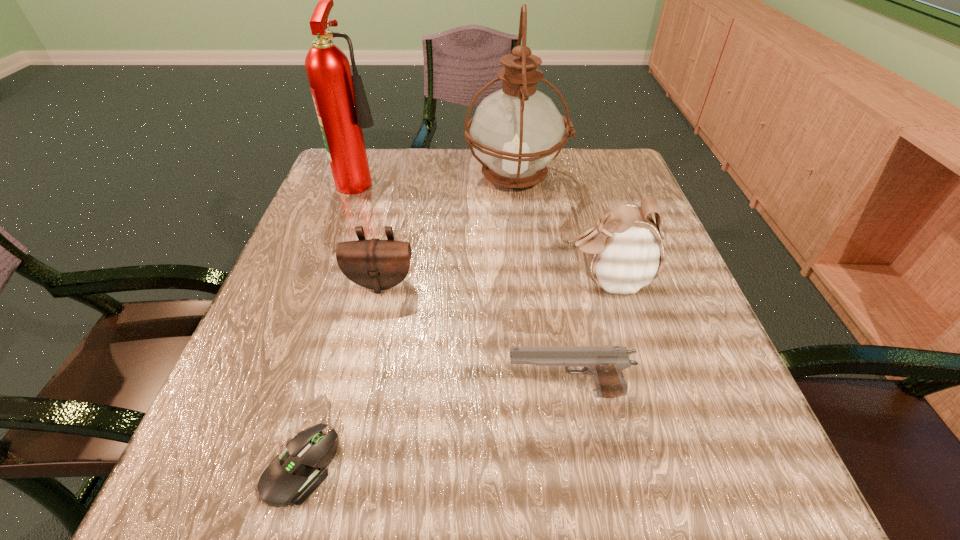
Locate an element on the screen. object present at the near edge is located at coordinates (292, 477).

Where is `fire extinguisher that is at the left edge`? fire extinguisher that is at the left edge is located at coordinates (340, 100).

The height and width of the screenshot is (540, 960). I want to click on pouch that is positioned at the left edge, so click(376, 264).

In order to click on computer mouse that is at the left edge in this screenshot , I will do 292,477.

Find the location of `oil lamp present at the right edge`. oil lamp present at the right edge is located at coordinates (517, 131).

The image size is (960, 540). I want to click on pouch that is at the right edge, so click(x=625, y=251).

Where is `pistol positioned at the right edge`? pistol positioned at the right edge is located at coordinates (605, 364).

Where is `object at the far left corner`? This screenshot has width=960, height=540. object at the far left corner is located at coordinates (340, 100).

The image size is (960, 540). I want to click on object that is at the near left corner, so click(292, 477).

The width and height of the screenshot is (960, 540). In order to click on object positioned at the far right corner in this screenshot , I will do `click(517, 131)`.